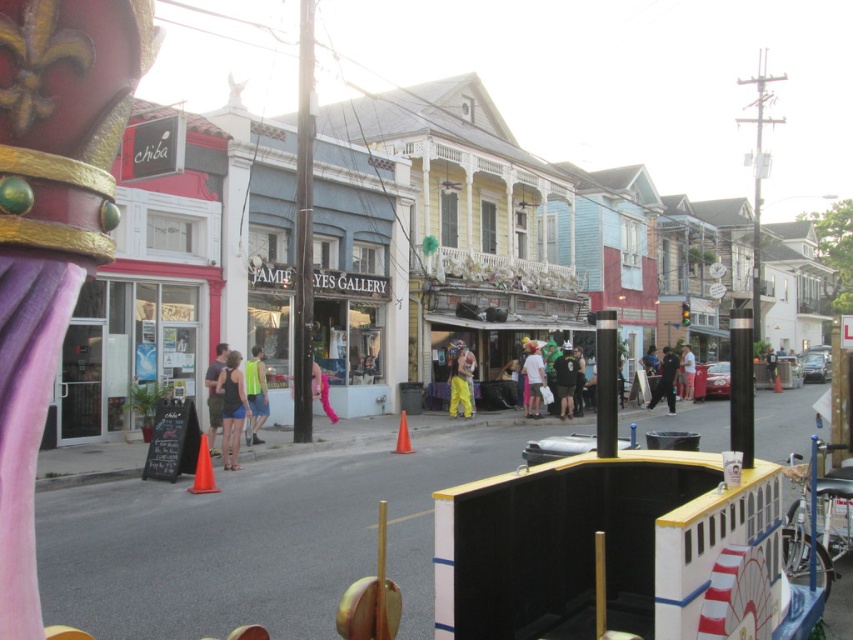
Does point (308, 376) come farther from viewer compared to point (209, 364)?

No, (308, 376) is in front of (209, 364).

Describe the element at coordinates (303, 230) in the screenshot. This screenshot has width=853, height=640. I see `black metal pole at center` at that location.

Locate an element on the screen. black metal pole at center is located at coordinates (303, 230).

Does black metal pole at center have a larger size compared to matte black tank top at center?

Indeed, black metal pole at center has a larger size compared to matte black tank top at center.

Is black metal pole at center taller than matte black tank top at center?

Yes, black metal pole at center is taller than matte black tank top at center.

Identify the location of black metal pole at center. (303, 230).

Who is higher up, neon green reflective vest at center or pink fabric dress at center?

Positioned higher is neon green reflective vest at center.

Can you confirm if neon green reflective vest at center is positioned to the left of pink fabric dress at center?

Correct, you'll find neon green reflective vest at center to the left of pink fabric dress at center.

Find the location of a particular element. neon green reflective vest at center is located at coordinates (256, 392).